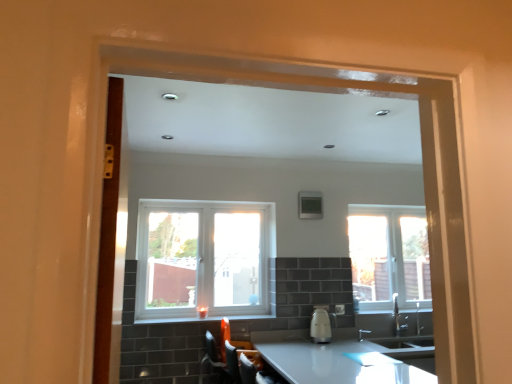
Question: Which direction should I rotate to look at white plastic window at center, arranged as the 2th window when viewed from the right?

Choices:
 (A) left
 (B) right

Answer: (A)

Question: Is white glossy window sill at center further to camera compared to white glossy kettle at center?

Choices:
 (A) no
 (B) yes

Answer: (A)

Question: From the image's perspective, does white glossy window sill at center appear lower than white glossy kettle at center?

Choices:
 (A) no
 (B) yes

Answer: (A)

Question: From a real-world perspective, is white glossy window sill at center physically above white glossy kettle at center?

Choices:
 (A) no
 (B) yes

Answer: (B)

Question: Does white glossy window sill at center have a lesser width compared to white glossy kettle at center?

Choices:
 (A) no
 (B) yes

Answer: (A)

Question: Is white glossy window sill at center outside white glossy kettle at center?

Choices:
 (A) no
 (B) yes

Answer: (B)

Question: Does white glossy window sill at center have a greater width compared to white glossy kettle at center?

Choices:
 (A) yes
 (B) no

Answer: (A)

Question: Is white glossy countertop at lower center facing towards white glossy window sill at center?

Choices:
 (A) yes
 (B) no

Answer: (B)

Question: Can you confirm if white glossy countertop at lower center is bigger than white glossy window sill at center?

Choices:
 (A) yes
 (B) no

Answer: (A)

Question: Could white glossy window sill at center be considered to be inside white glossy countertop at lower center?

Choices:
 (A) yes
 (B) no

Answer: (B)

Question: Can you confirm if white glossy countertop at lower center is positioned to the right of white glossy window sill at center?

Choices:
 (A) no
 (B) yes

Answer: (B)

Question: Does white glossy countertop at lower center have a lesser height compared to white glossy window sill at center?

Choices:
 (A) yes
 (B) no

Answer: (B)

Question: Is white glossy countertop at lower center completely or partially outside of white glossy window sill at center?

Choices:
 (A) yes
 (B) no

Answer: (A)

Question: Is white glossy kettle at center taller than white plastic window at center, arranged as the 2th window when viewed from the right?

Choices:
 (A) no
 (B) yes

Answer: (A)